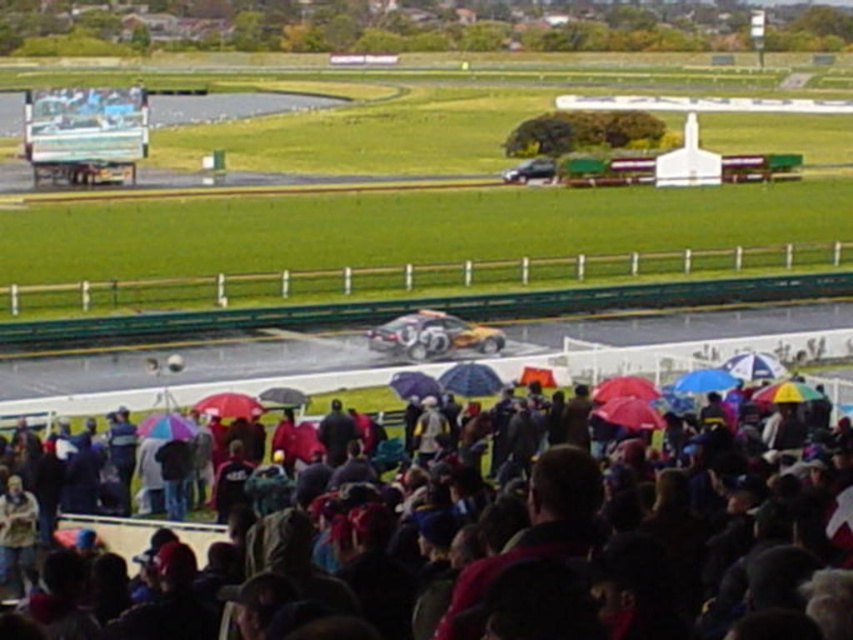
Can you confirm if denim jacket at lower left is positioned to the right of rainbow fabric umbrella at center?

Incorrect, denim jacket at lower left is not on the right side of rainbow fabric umbrella at center.

Is denim jacket at lower left wider than rainbow fabric umbrella at center?

In fact, denim jacket at lower left might be narrower than rainbow fabric umbrella at center.

In order to click on denim jacket at lower left in this screenshot , I will do `click(16, 536)`.

Between point (788, 570) and point (3, 540), which one is positioned in front?

Point (788, 570) is in front.

Between rainbow umbrellas at lower center and denim jacket at lower left, which one is positioned lower?

denim jacket at lower left

You are a GUI agent. You are given a task and a screenshot of the screen. Output one action in this format:
    pyautogui.click(x=<x>, y=<y>)
    Task: Click on the rainbow umbrellas at lower center
    
    Given the screenshot: What is the action you would take?
    pyautogui.click(x=625, y=538)

Find the location of a particular element. The image size is (853, 640). rainbow umbrellas at lower center is located at coordinates (625, 538).

Is point (447, 586) farther from camera compared to point (231, 397)?

No.

Does rainbow umbrellas at lower center have a lesser height compared to red matte umbrella at lower center?

No, rainbow umbrellas at lower center is not shorter than red matte umbrella at lower center.

Find the location of a particular element. rainbow umbrellas at lower center is located at coordinates (625, 538).